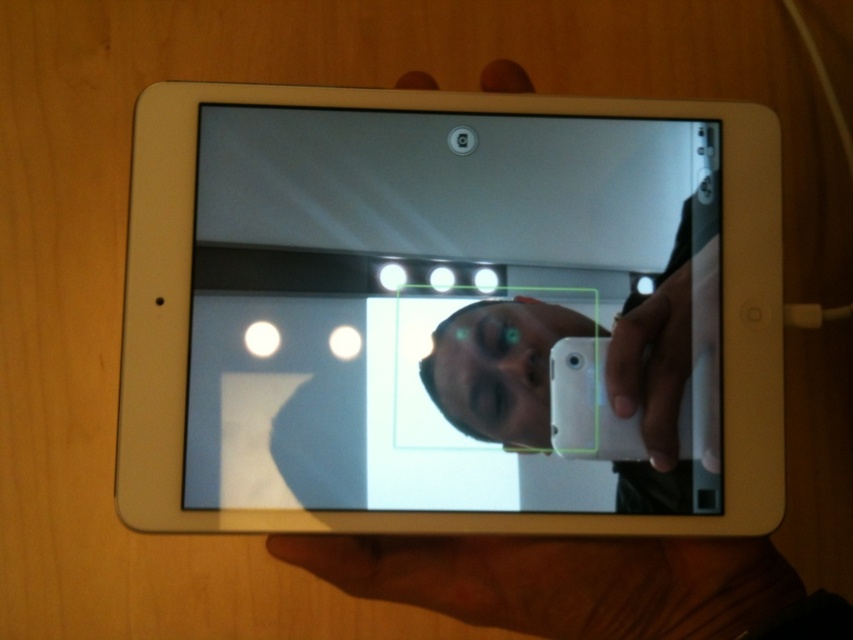
How distant is white plastic tablet at center from brown leather hand at lower center?

white plastic tablet at center is 3.73 inches from brown leather hand at lower center.

Can you confirm if white plastic tablet at center is positioned to the right of brown leather hand at lower center?

In fact, white plastic tablet at center is to the left of brown leather hand at lower center.

The height and width of the screenshot is (640, 853). Find the location of `white plastic tablet at center`. white plastic tablet at center is located at coordinates (448, 314).